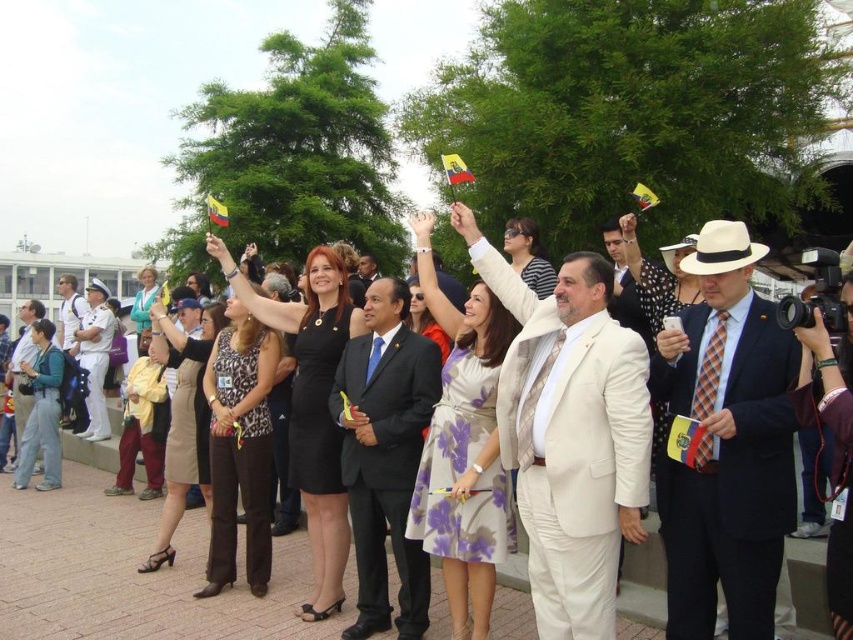
Question: Is white satin suit at center positioned in front of matte black suit at center?

Choices:
 (A) no
 (B) yes

Answer: (B)

Question: Which point is farther to the camera?

Choices:
 (A) white satin suit at center
 (B) matte black suit at left
 (C) matte black suit at center

Answer: (B)

Question: Does white uniform at left appear on the left side of light blue denim jacket at left?

Choices:
 (A) no
 (B) yes

Answer: (A)

Question: Which point is farther from the camera taking this photo?

Choices:
 (A) (726, 419)
 (B) (552, 396)

Answer: (B)

Question: Is white textured suit at center positioned before matte black suit at left?

Choices:
 (A) no
 (B) yes

Answer: (B)

Question: Which point appears farthest from the camera in this image?

Choices:
 (A) (595, 544)
 (B) (71, 426)
 (C) (426, 340)
 (D) (660, 534)

Answer: (B)